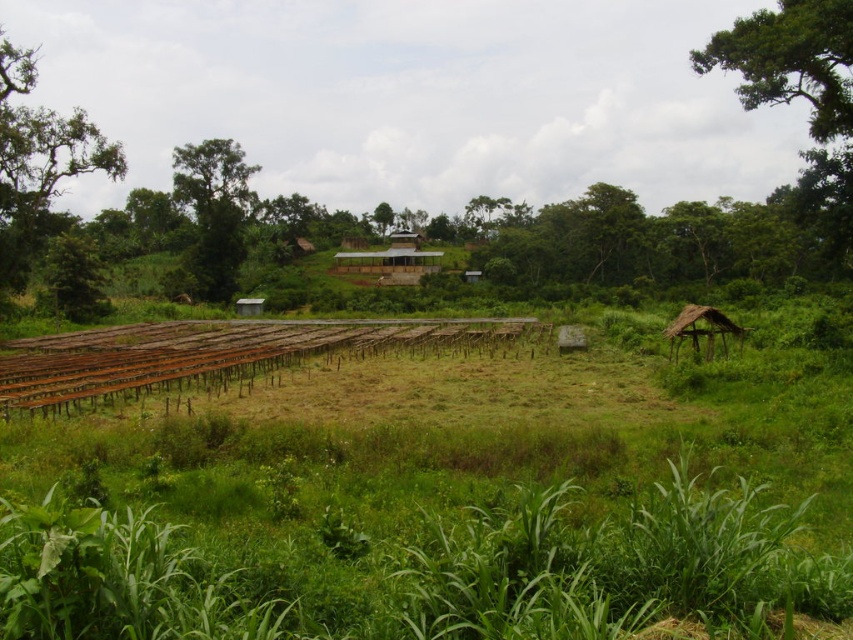
You are standing in the rural landscape and want to walk from the rusty metal train track at center to the green leafy tree at upper left. Which direction should you head to get closer to the tree?

The rusty metal train track at center is closer to the viewer than the green leafy tree at upper left. To reach the green leafy tree at upper left, you should walk away from the train track towards the tree since it is farther back in the scene.

You are a delivery person trying to reach the thatched straw hut at right to drop off a package. There is a rusty metal train track at center in your path. Based on the scene, can you walk over the train track to reach the hut?

The rusty metal train track at center is below the thatched straw hut at right, so the train track is closer to the ground. Since it is a metal track, you can safely walk over the rusty metal train track at center to reach the thatched straw hut at right.

You are standing at the center of the image. Which direction should you walk to reach the rusty metal train track at center?

Since the rusty metal train track at center is located at point coordinates of (210, 352), you should walk towards the lower right direction from the center to reach it.